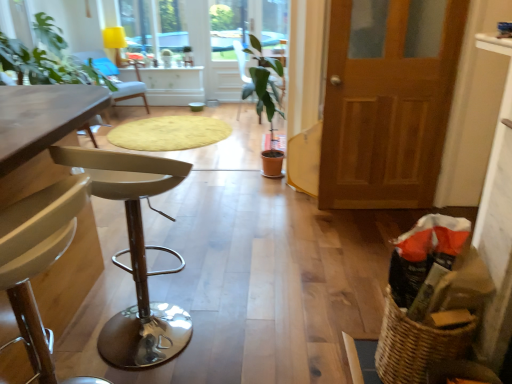
Locate an element on the screen. The height and width of the screenshot is (384, 512). vacant space underneath metallic silver stool at left, the third chair in the back-to-front sequence (from a real-world perspective) is located at coordinates (169, 334).